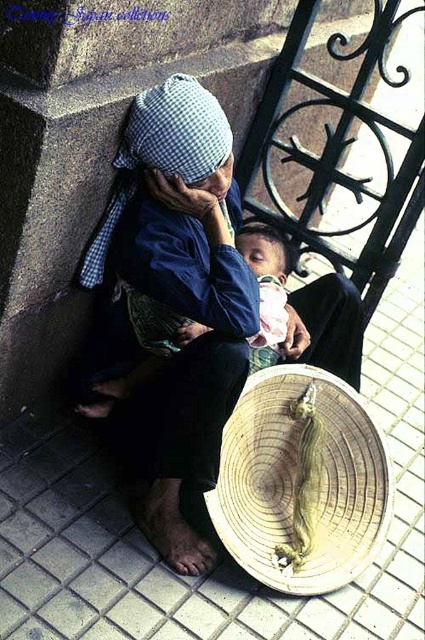
Question: Does blue checkered fabric at center appear on the right side of white checkered fabric at upper left?

Choices:
 (A) yes
 (B) no

Answer: (B)

Question: Which of the following is the closest to the observer?

Choices:
 (A) (44, 417)
 (B) (153, 449)
 (C) (142, 99)

Answer: (C)

Question: Which point is closer to the camera taking this photo?

Choices:
 (A) (229, 333)
 (B) (229, 580)
 (C) (291, 586)
 (D) (153, 138)

Answer: (D)

Question: Is blue checkered fabric at center smaller than woven straw basket at lower center?

Choices:
 (A) yes
 (B) no

Answer: (B)

Question: Among these objects, which one is nearest to the camera?

Choices:
 (A) white checkered fabric at upper left
 (B) blue checkered fabric at center
 (C) woven straw basket at lower center
 (D) white tile pavement at lower center

Answer: (D)

Question: Can you confirm if white tile pavement at lower center is smaller than white checkered fabric at upper left?

Choices:
 (A) no
 (B) yes

Answer: (A)